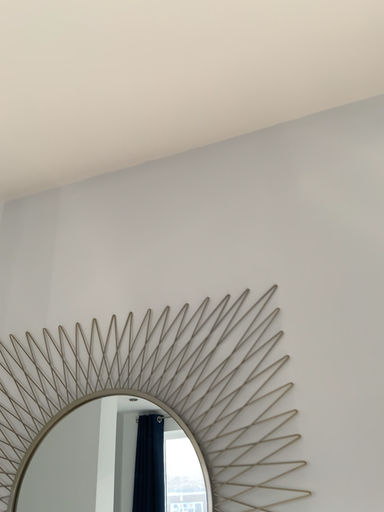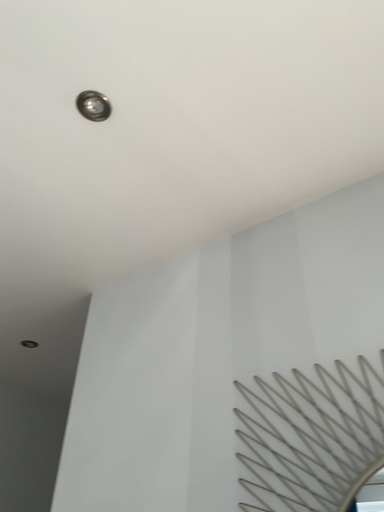
Question: How did the camera likely rotate when shooting the video?

Choices:
 (A) rotated upward
 (B) rotated downward

Answer: (A)